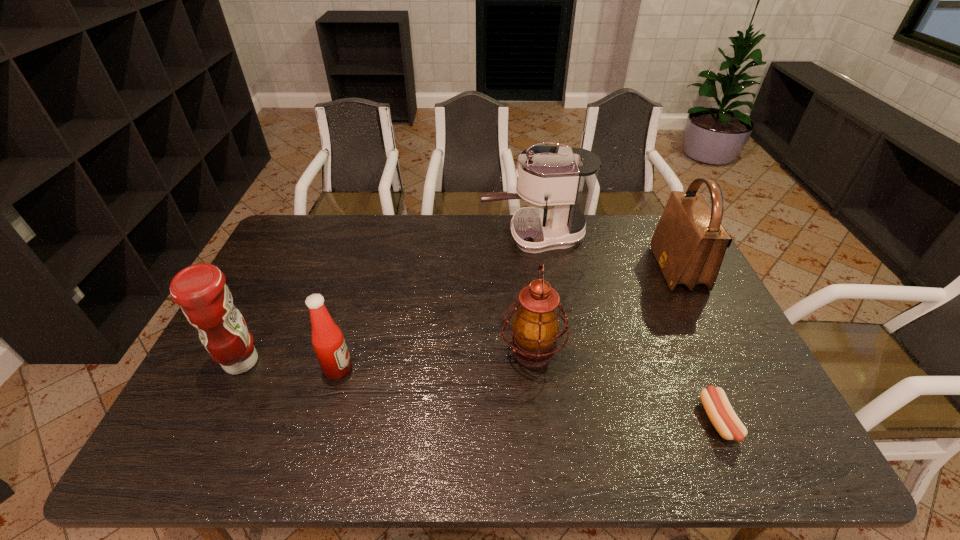
Point out which object is positioned as the nearest to the coffee maker. Please provide its 2D coordinates. Your answer should be formatted as a tuple, i.e. [(x, y)], where the tuple contains the x and y coordinates of a point satisfying the conditions above.

[(689, 243)]

Identify which object is the second closest to the right condiment. Please provide its 2D coordinates. Your answer should be formatted as a tuple, i.e. [(x, y)], where the tuple contains the x and y coordinates of a point satisfying the conditions above.

[(535, 327)]

Identify the location of vacant area that satisfies the following two spatial constraints: 1. on the front flap of the shoulder bag; 2. on the front side of the oil lamp. (720, 352).

The image size is (960, 540). I want to click on free space that satisfies the following two spatial constraints: 1. on the front-facing side of the coffee maker; 2. on the right side of the shortest object, so click(561, 421).

Where is `vacant space that satisfies the following two spatial constraints: 1. on the front flap of the shoulder bag; 2. on the front side of the nearest object`? vacant space that satisfies the following two spatial constraints: 1. on the front flap of the shoulder bag; 2. on the front side of the nearest object is located at coordinates (755, 421).

This screenshot has height=540, width=960. Find the location of `free spot that satisfies the following two spatial constraints: 1. on the front-facing side of the shortest object; 2. on the right side of the shorter condiment`. free spot that satisfies the following two spatial constraints: 1. on the front-facing side of the shortest object; 2. on the right side of the shorter condiment is located at coordinates (323, 421).

Where is `vacant region that satisfies the following two spatial constraints: 1. on the back side of the shortest object; 2. on the front-facing side of the coffee maker`? The height and width of the screenshot is (540, 960). vacant region that satisfies the following two spatial constraints: 1. on the back side of the shortest object; 2. on the front-facing side of the coffee maker is located at coordinates (637, 237).